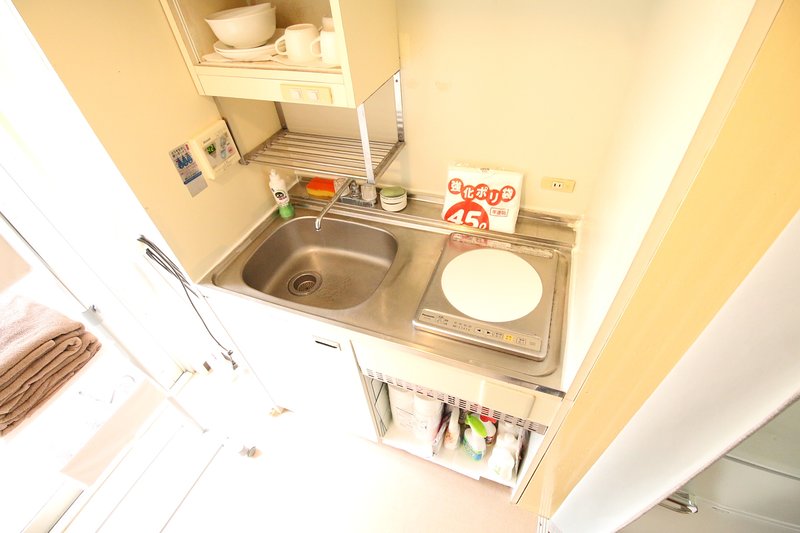
In order to click on white mug in this screenshot , I will do `click(301, 56)`.